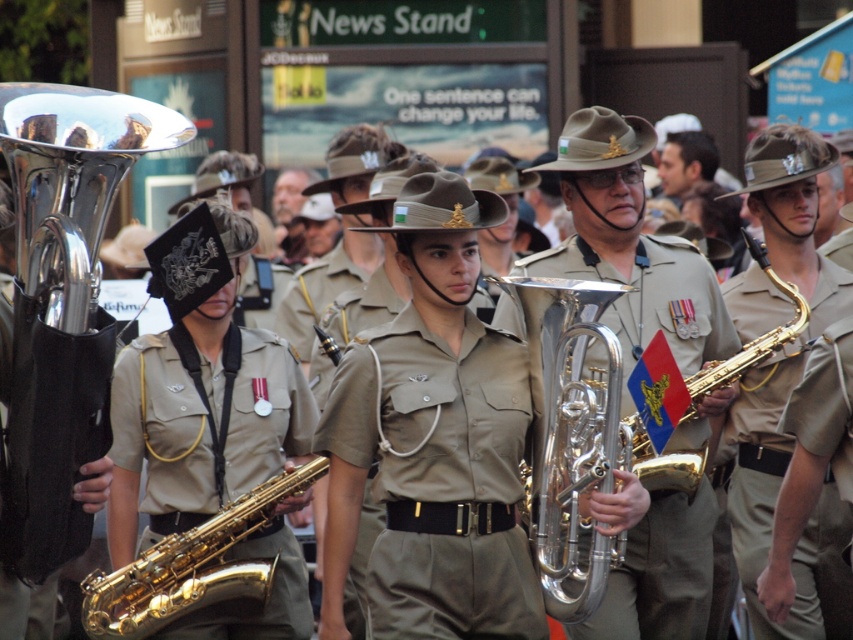
Looking at this image, you are a photographer positioned to the side of the marching band. You want to capture a photo where the metallic brass tuba at center and the khaki fabric uniform at center are both visible. Based on their positions, which object should appear lower in the photo?

The metallic brass tuba at center is positioned below the khaki fabric uniform at center, so in the photo, the metallic brass tuba at center will appear lower than the khaki fabric uniform at center.

You are a photographer trying to capture a closeup shot of the olive green fabric uniform at center and the khaki fabric uniform at center. Which uniform should you focus on to ensure it fits entirely within your camera frame if your frame can only accommodate the narrower object?

The olive green fabric uniform at center has a lesser width compared to khaki fabric uniform at center, so you should focus on the olive green fabric uniform at center to ensure it fits entirely within your camera frame.

You are standing in front of the military band members. There are two points marked on the image, one at coordinate point (515, 532) and another at point (741, 577). Which point is closer to you?

Point (515, 532) is closer to the camera than point (741, 577).